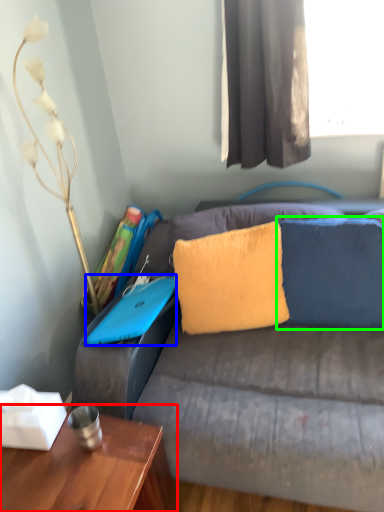
Question: Which object is the farthest from table (highlighted by a red box)? Choose among these: laptop (highlighted by a blue box) or pillow (highlighted by a green box).

Choices:
 (A) laptop
 (B) pillow

Answer: (B)